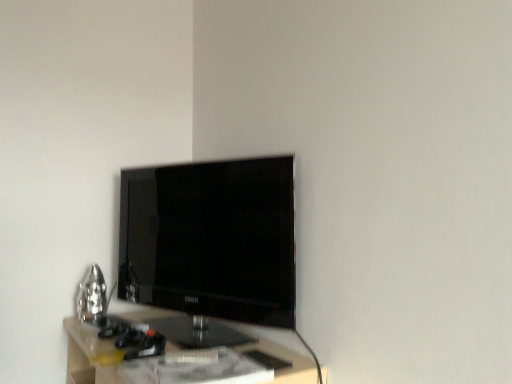
This screenshot has width=512, height=384. What do you see at coordinates (210, 246) in the screenshot?
I see `black glossy tv at center` at bounding box center [210, 246].

This screenshot has height=384, width=512. I want to click on black glossy tv at center, so click(210, 246).

Where is `black glossy tv at center`? This screenshot has width=512, height=384. black glossy tv at center is located at coordinates (210, 246).